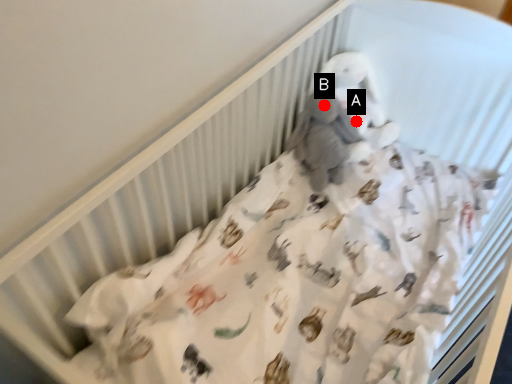
Question: Two points are circled on the image, labeled by A and B beside each circle. Among these points, which one is nearest to the camera?

Choices:
 (A) A is closer
 (B) B is closer

Answer: (B)